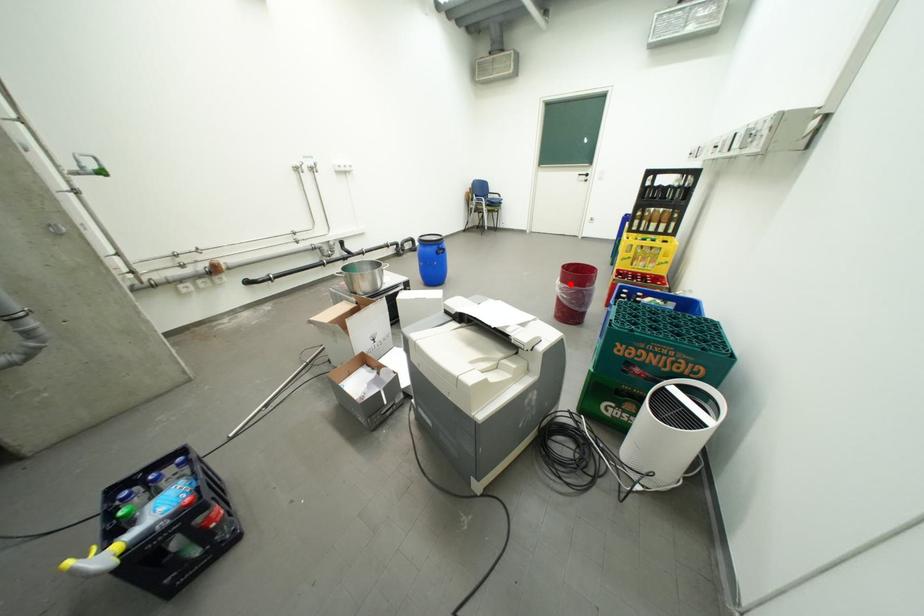
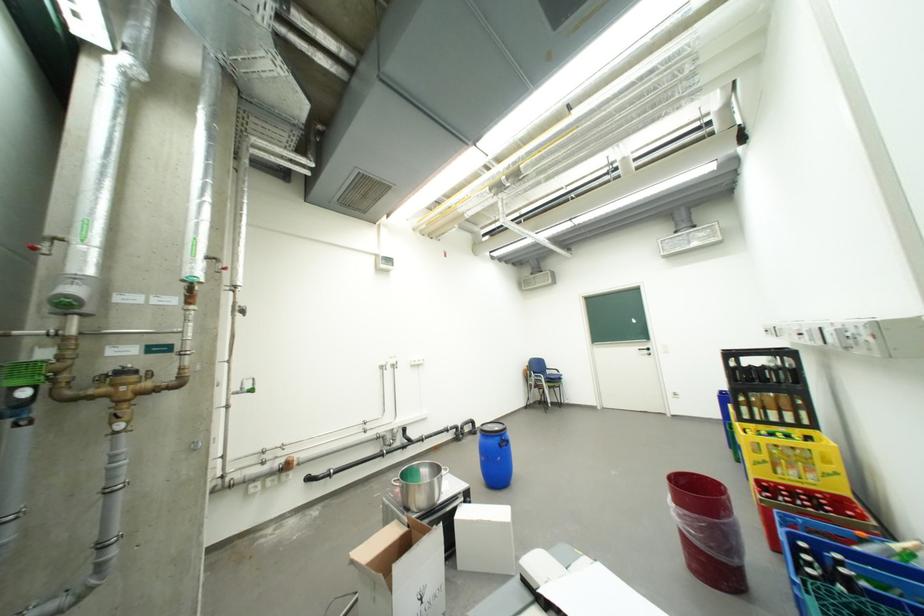
Where in the second image is the point corresponding to the highlighted location from the first image?

(685, 507)